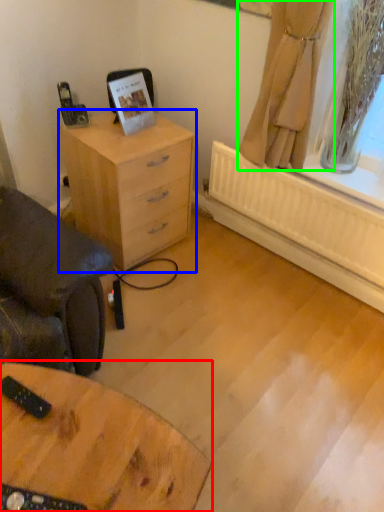
Question: Based on their relative distances, which object is nearer to table (highlighted by a red box)? Choose from chest of drawers (highlighted by a blue box) and curtain (highlighted by a green box).

Choices:
 (A) chest of drawers
 (B) curtain

Answer: (A)